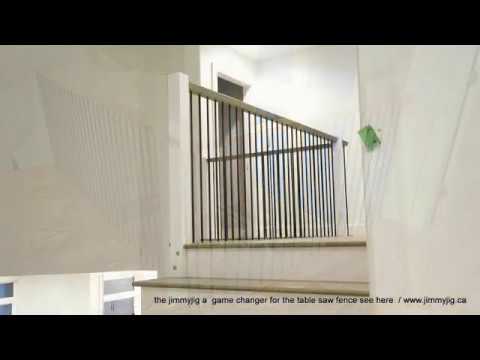
Locate an element on the screen. This screenshot has width=480, height=360. hand rails on top of balustrade is located at coordinates (267, 111), (245, 154).